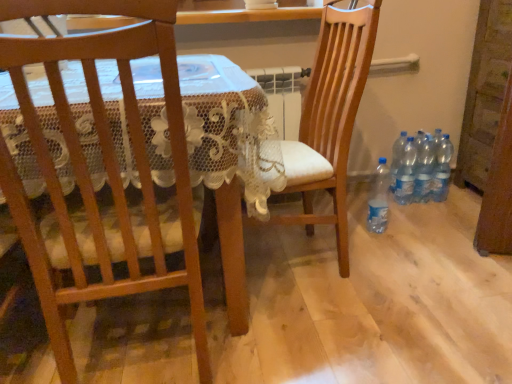
Locate an element on the screen. This screenshot has width=512, height=384. free space in front of clear plastic bottles at lower right, placed as the fourth bottle when sorted from right to left is located at coordinates (409, 211).